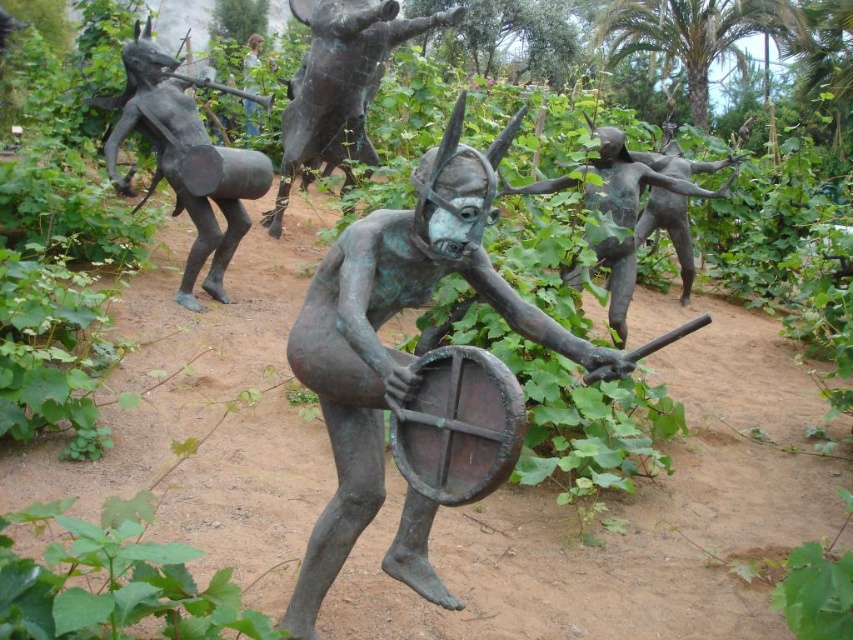
Is green patina bronze figure at center-right to the right of blue-green bronze figure at center from the viewer's perspective?

Correct, you'll find green patina bronze figure at center-right to the right of blue-green bronze figure at center.

Does green patina bronze figure at center-right have a larger size compared to blue-green bronze figure at center?

Yes, green patina bronze figure at center-right is bigger than blue-green bronze figure at center.

The image size is (853, 640). What do you see at coordinates (628, 211) in the screenshot? I see `green patina bronze figure at center-right` at bounding box center [628, 211].

Locate an element on the screen. Image resolution: width=853 pixels, height=640 pixels. green patina bronze figure at center-right is located at coordinates (628, 211).

Who is more distant from viewer, (187, 177) or (614, 188)?

The point (187, 177) is behind.

Is point (136, 209) closer to viewer compared to point (561, 186)?

No, it is not.

Describe the element at coordinates (184, 157) in the screenshot. The width and height of the screenshot is (853, 640). I see `bronze drum at upper left` at that location.

This screenshot has width=853, height=640. What are the coordinates of `bronze drum at upper left` in the screenshot? It's located at (184, 157).

How far apart are bronze drum at center and blue-green bronze figure at center?

A distance of 3.05 meters exists between bronze drum at center and blue-green bronze figure at center.

This screenshot has height=640, width=853. What do you see at coordinates (338, 83) in the screenshot? I see `bronze drum at center` at bounding box center [338, 83].

You are a GUI agent. You are given a task and a screenshot of the screen. Output one action in this format:
    pyautogui.click(x=<x>, y=<y>)
    Task: Click on the bronze drum at center
    Image resolution: width=853 pixels, height=640 pixels.
    Given the screenshot: What is the action you would take?
    coord(338,83)

This screenshot has height=640, width=853. I want to click on bronze drum at center, so click(338, 83).